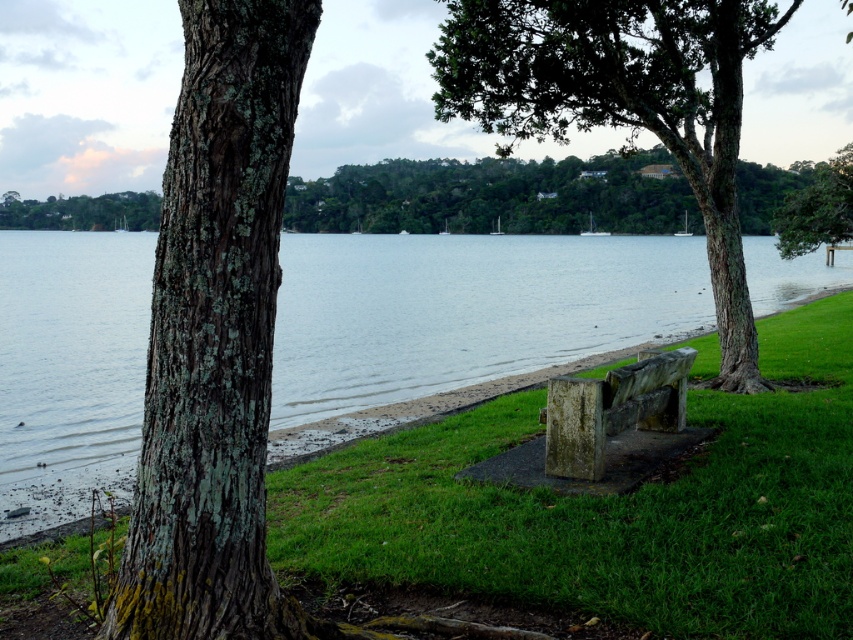
You are standing at the origin point of the coordinate system in the lakeside scene. The rusty stone bench at center is located at coordinate point 0.641, 0.719. If you want to walk directly to the bench, which direction should you head?

Since the rusty stone bench at center is located at coordinate point [612,410], you should head towards the direction of increasing x and y coordinates to reach it.